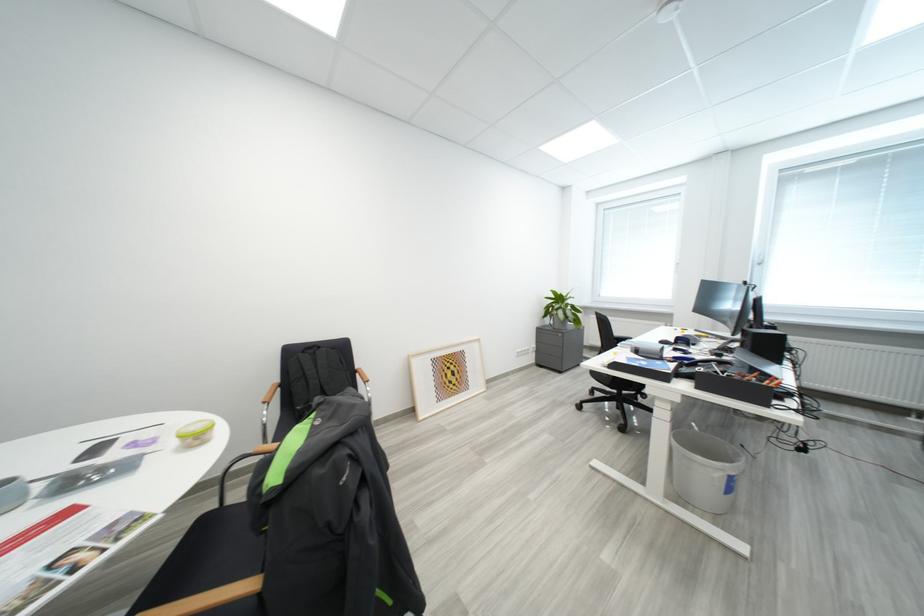
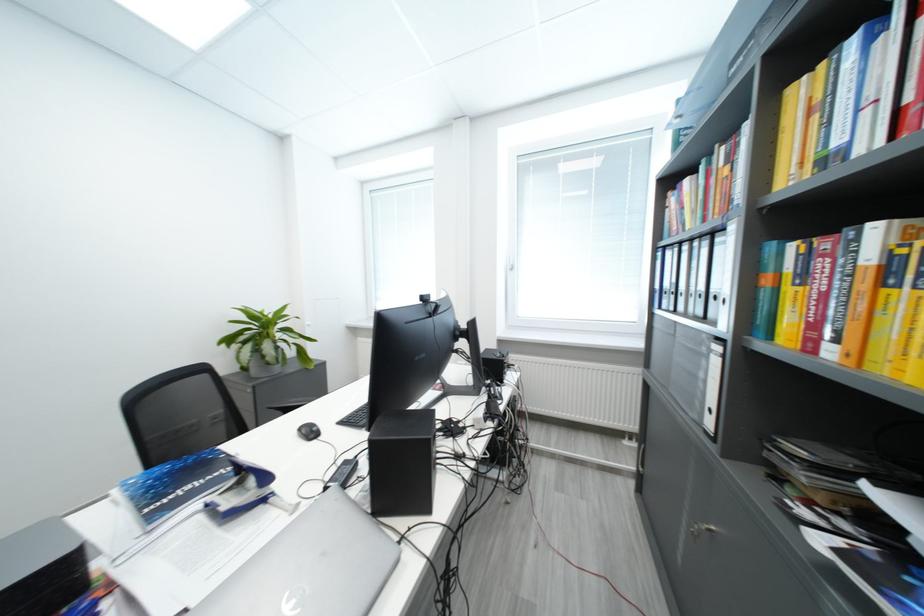
What movement of the cameraman would produce the second image?

The cameraman moved toward right, forward.